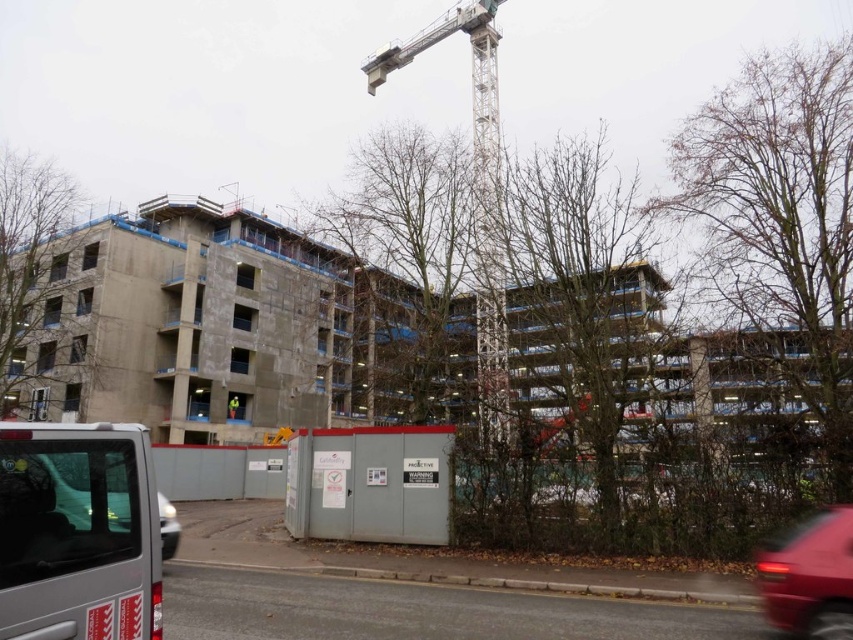
What are the coordinates of the gray concrete construction site at center?

The gray concrete construction site at center is located at coordinates point (399, 600).

You are a delivery driver approaching the construction site. You need to pass under the metallic gray crane at upper center while driving your matte black van at lower left. Can your van safely pass under the crane without hitting it?

The metallic gray crane at upper center is taller than the matte black van at lower left, so the van can safely pass under the crane without hitting it.